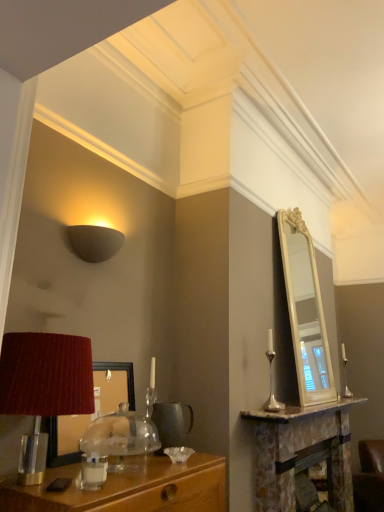
Measure the distance between brown leather swivel chair at lower right and camera.

A distance of 3.25 meters exists between brown leather swivel chair at lower right and camera.

What do you see at coordinates (89, 415) in the screenshot? I see `matte black mirror at left` at bounding box center [89, 415].

I want to click on brown leather swivel chair at lower right, so 369,477.

Can you confirm if matte gray wall sconce at upper left is positioned to the left of brown leather swivel chair at lower right?

Correct, you'll find matte gray wall sconce at upper left to the left of brown leather swivel chair at lower right.

Looking at this image, looking at their sizes, would you say matte gray wall sconce at upper left is wider or thinner than brown leather swivel chair at lower right?

Considering their sizes, matte gray wall sconce at upper left looks slimmer than brown leather swivel chair at lower right.

Do you think matte gray wall sconce at upper left is within brown leather swivel chair at lower right, or outside of it?

matte gray wall sconce at upper left lies outside brown leather swivel chair at lower right.

Is matte gray wall sconce at upper left not near brown leather swivel chair at lower right?

Indeed, matte gray wall sconce at upper left is not near brown leather swivel chair at lower right.

Is point (338, 504) farther from viewer compared to point (85, 226)?

Yes, point (338, 504) is farther from viewer.

Is marble fireplace at right further to camera compared to matte gray wall sconce at upper left?

Yes, it is behind matte gray wall sconce at upper left.

Is marble fireplace at right next to matte gray wall sconce at upper left and touching it?

No, marble fireplace at right is not with matte gray wall sconce at upper left.

Is marble fireplace at right looking in the opposite direction of matte gray wall sconce at upper left?

No.

Is matte black mirror at left placed right next to brown leather swivel chair at lower right?

No.

Is brown leather swivel chair at lower right completely or partially inside matte black mirror at left?

No, brown leather swivel chair at lower right is not inside matte black mirror at left.

Image resolution: width=384 pixels, height=512 pixels. Identify the location of swivel chair behind the matte black mirror at left. (369, 477).

Considering the points (376, 444) and (106, 257), which point is in front, point (376, 444) or point (106, 257)?

Point (106, 257)

Does brown leather swivel chair at lower right come in front of matte gray wall sconce at upper left?

That is False.

What are the coordinates of `lamp in front of the brown leather swivel chair at lower right` in the screenshot? It's located at (94, 242).

Is brown leather swivel chair at lower right positioned far away from matte gray wall sconce at upper left?

Yes.

Can we say matte red lampshade at left lies outside matte black mirror at left?

Yes, matte red lampshade at left is not within matte black mirror at left.

From a real-world perspective, is matte red lampshade at left located beneath matte black mirror at left?

No, from a real-world perspective, matte red lampshade at left is not under matte black mirror at left.

Between matte red lampshade at left and matte black mirror at left, which one appears on the right side from the viewer's perspective?

Positioned to the right is matte black mirror at left.

Is matte gray wall sconce at upper left positioned with its back to matte red lampshade at left?

No, matte gray wall sconce at upper left's orientation is not away from matte red lampshade at left.

How far apart are matte gray wall sconce at upper left and matte red lampshade at left?

The distance of matte gray wall sconce at upper left from matte red lampshade at left is 24.96 inches.

From the picture: Considering the relative positions of matte gray wall sconce at upper left and matte red lampshade at left in the image provided, is matte gray wall sconce at upper left to the left or to the right of matte red lampshade at left?

In the image, matte gray wall sconce at upper left appears on the right side of matte red lampshade at left.

Which object is further away from the camera, matte red lampshade at left or matte gray wall sconce at upper left?

Positioned behind is matte gray wall sconce at upper left.

Considering the positions of objects matte red lampshade at left and matte gray wall sconce at upper left in the image provided, who is more to the left, matte red lampshade at left or matte gray wall sconce at upper left?

Positioned to the left is matte red lampshade at left.

Measure the distance between matte red lampshade at left and matte gray wall sconce at upper left.

A distance of 24.96 inches exists between matte red lampshade at left and matte gray wall sconce at upper left.

From the image's perspective, which is below, matte red lampshade at left or matte gray wall sconce at upper left?

matte red lampshade at left.

This screenshot has height=512, width=384. I want to click on lamp that is on the left side of brown leather swivel chair at lower right, so (x=94, y=242).

Locate an element on the screen. This screenshot has height=512, width=384. lamp above the marble fireplace at right (from a real-world perspective) is located at coordinates (94, 242).

Which object lies nearer to the anchor point marble fireplace at right, matte gray wall sconce at upper left or brown leather swivel chair at lower right?

The object closer to marble fireplace at right is brown leather swivel chair at lower right.

Estimate the real-world distances between objects in this image. Which object is further from brown leather swivel chair at lower right, matte red lampshade at left or matte black mirror at left?

The object further to brown leather swivel chair at lower right is matte red lampshade at left.

Which object lies nearer to the anchor point matte gray wall sconce at upper left, marble fireplace at right or matte black mirror at left?

matte black mirror at left.

Looking at the image, which one is located closer to matte red lampshade at left, brown leather swivel chair at lower right or matte gray wall sconce at upper left?

The object closer to matte red lampshade at left is matte gray wall sconce at upper left.

Considering their positions, is matte red lampshade at left positioned further to matte black mirror at left than matte gray wall sconce at upper left?

Based on the image, matte gray wall sconce at upper left appears to be further to matte black mirror at left.

From the image, which object appears to be nearer to matte gray wall sconce at upper left, matte black mirror at left or brown leather swivel chair at lower right?

matte black mirror at left.

Estimate the real-world distances between objects in this image. Which object is closer to matte black mirror at left, marble fireplace at right or brown leather swivel chair at lower right?

Among the two, marble fireplace at right is located nearer to matte black mirror at left.

In the scene shown: From the image, which object appears to be nearer to brown leather swivel chair at lower right, matte gray wall sconce at upper left or matte red lampshade at left?

matte gray wall sconce at upper left is closer to brown leather swivel chair at lower right.

I want to click on mirror situated between matte red lampshade at left and brown leather swivel chair at lower right from left to right, so click(89, 415).

Identify the location of table lamp between matte gray wall sconce at upper left and marble fireplace at right in the vertical direction. (44, 386).

Where is `mirror between matte gray wall sconce at upper left and marble fireplace at right from top to bottom`? This screenshot has height=512, width=384. mirror between matte gray wall sconce at upper left and marble fireplace at right from top to bottom is located at coordinates (89, 415).

Where is `table between matte black mirror at left and brown leather swivel chair at lower right`? table between matte black mirror at left and brown leather swivel chair at lower right is located at coordinates (301, 453).